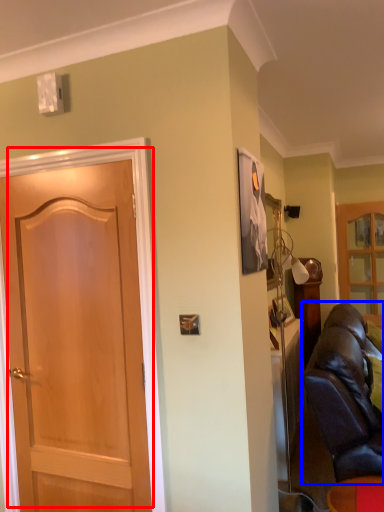
Question: Among these objects, which one is farthest to the camera, door (highlighted by a red box) or studio couch (highlighted by a blue box)?

Choices:
 (A) door
 (B) studio couch

Answer: (B)